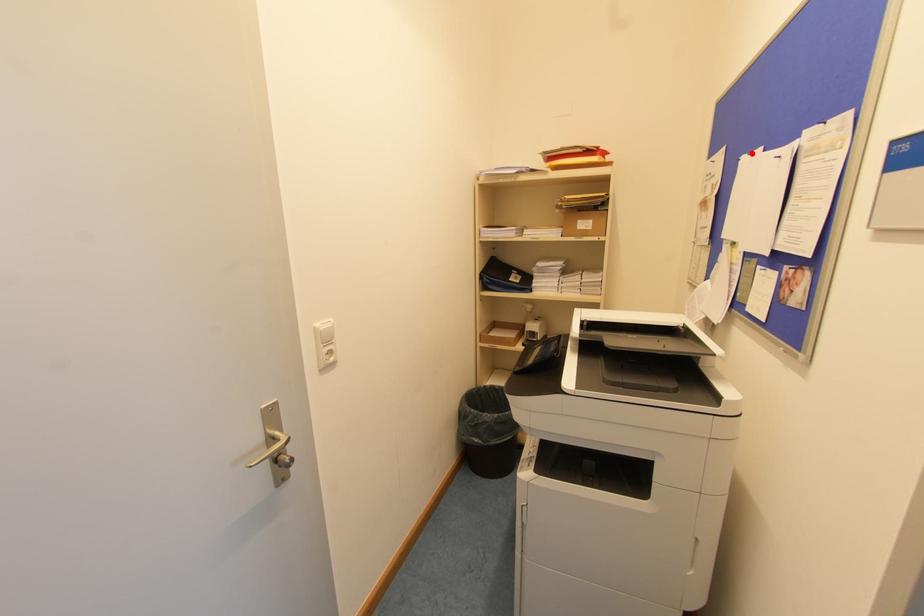
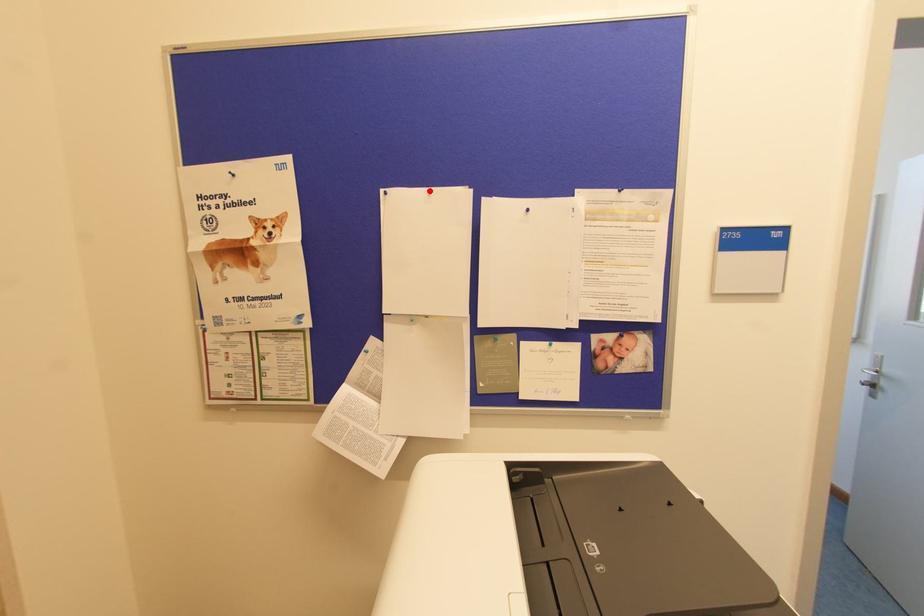
I am providing you with two images of the same scene from different viewpoints. A red point is marked on the first image and another point is marked on the second image. Are the points marked in image1 and image2 representing the same 3D position?

Yes